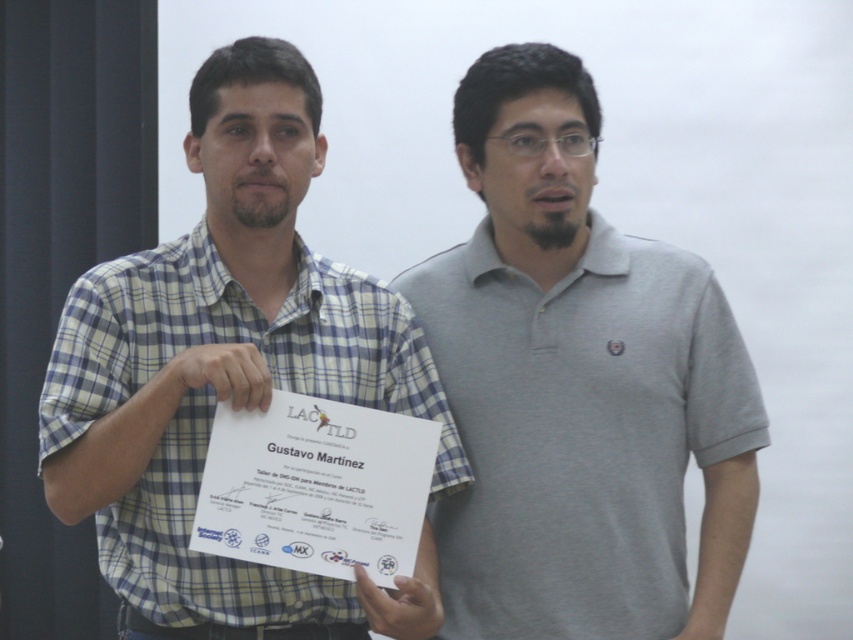
Consider the image. You are organizing a photo shoot and need to decide which of the two shirts displayed at the center of the image to use for a closeup shot. The gray cotton polo shirt at center and the checkered fabric shirt at center are both options. Based on their sizes, which one would be more suitable for a closeup to ensure details are clearly visible?

The checkered fabric shirt at center is larger than the gray cotton polo shirt at center, making it more suitable for a closeup to ensure details are clearly visible.